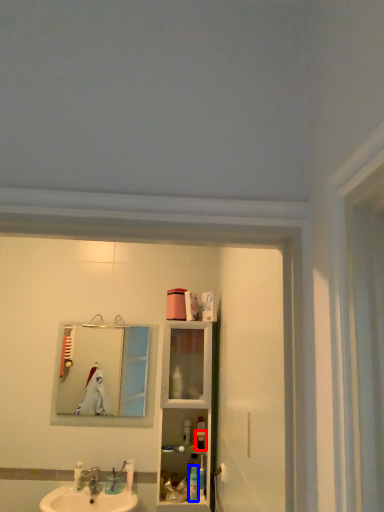
Question: Which object appears closest to the camera in this image, toiletry (highlighted by a red box) or toiletry (highlighted by a blue box)?

Choices:
 (A) toiletry
 (B) toiletry

Answer: (B)